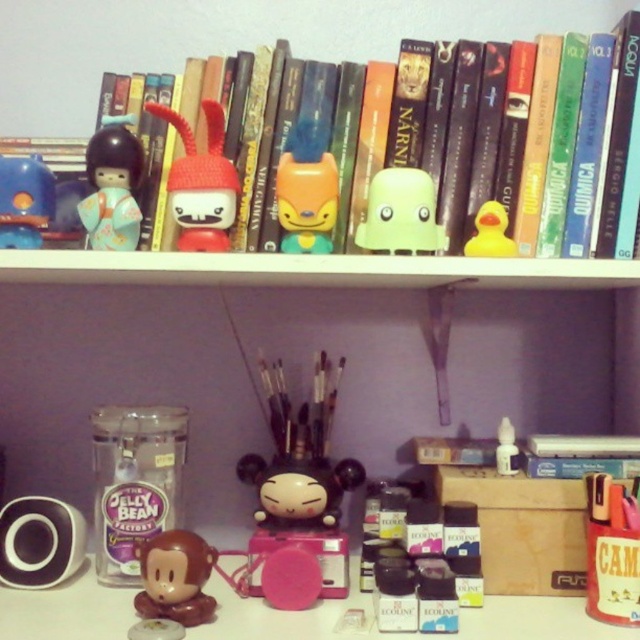
You are an interior designer planning to place a new decorative item on the shelf. You notice the point marked at coordinate (24, 200) which corresponds to an object on the shelf. What object is located at that coordinate?

The point at coordinate (24, 200) corresponds to the matte blue rubber duck at upper left.